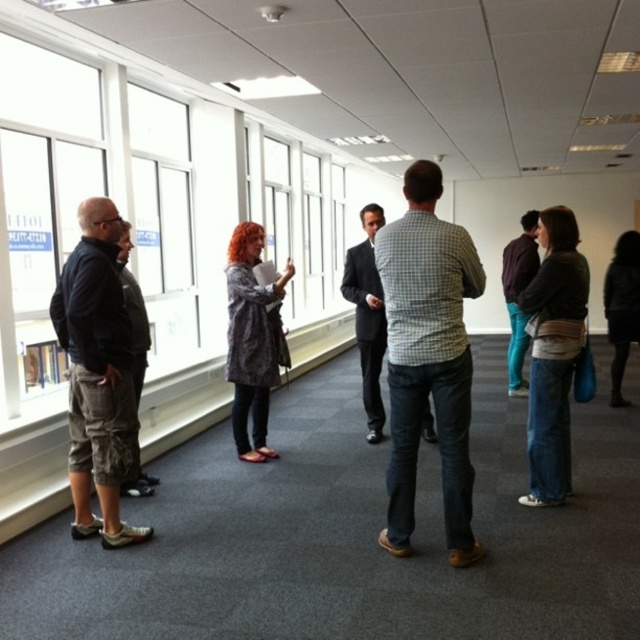
You are a tailor who needs to determine which item has a narrower width between the denim jeans at lower right and the patterned fabric coat at center. Which one is narrower?

The denim jeans at lower right is thinner than the patterned fabric coat at center, so the denim jeans at lower right is narrower in width.